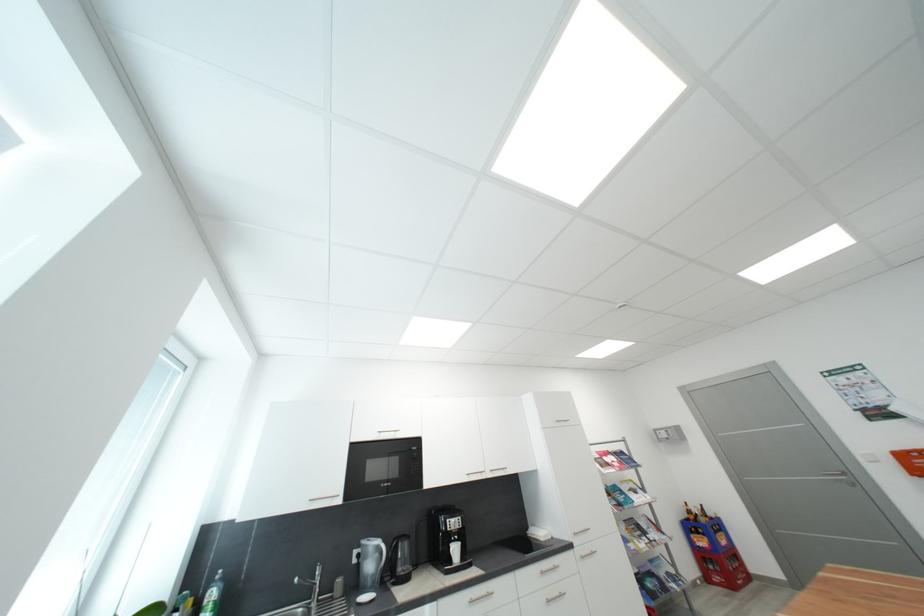
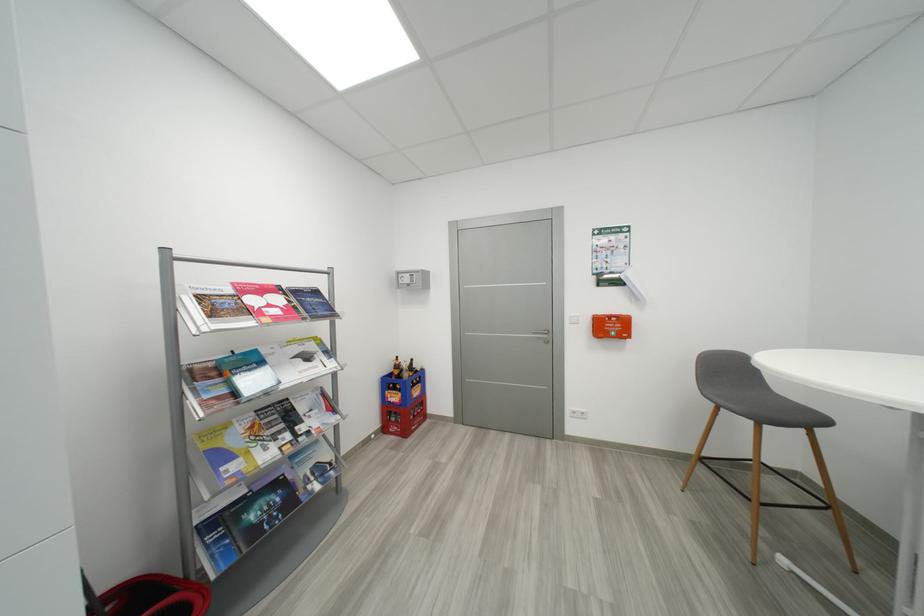
The point at (697, 514) is marked in the first image. Where is the corresponding point in the second image?

(404, 369)